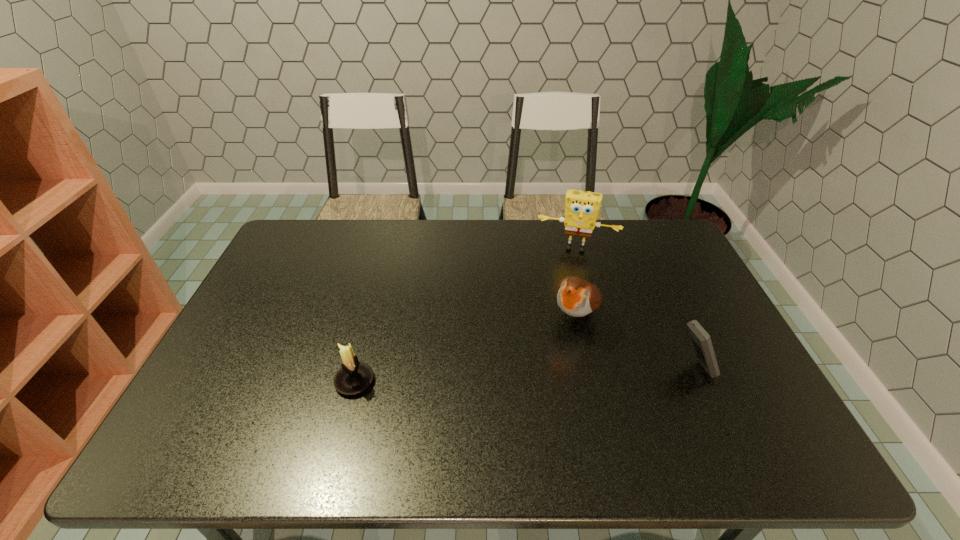
Select which object is the closest to the calculator. Please provide its 2D coordinates. Your answer should be formatted as a tuple, i.e. [(x, y)], where the tuple contains the x and y coordinates of a point satisfying the conditions above.

[(576, 297)]

Where is `free space that satisfies the following two spatial constraints: 1. on the back side of the candle holder; 2. on the right side of the sponge`? This screenshot has height=540, width=960. free space that satisfies the following two spatial constraints: 1. on the back side of the candle holder; 2. on the right side of the sponge is located at coordinates pyautogui.click(x=389, y=248).

Identify the location of free spot that satisfies the following two spatial constraints: 1. on the front side of the sponge; 2. on the front-facing side of the calculator. (609, 368).

Identify the location of free location that satisfies the following two spatial constraints: 1. on the back side of the candle holder; 2. on the left side of the second farthest object. Image resolution: width=960 pixels, height=540 pixels. (372, 316).

Locate an element on the screen. free space that satisfies the following two spatial constraints: 1. on the front side of the farthest object; 2. on the front-facing side of the rightmost object is located at coordinates (609, 368).

The height and width of the screenshot is (540, 960). I want to click on free spot that satisfies the following two spatial constraints: 1. on the back side of the candle holder; 2. on the front-facing side of the calculator, so click(x=358, y=368).

Where is `vacant space that satisfies the following two spatial constraints: 1. on the front side of the calculator; 2. on the front-facing side of the bird`? Image resolution: width=960 pixels, height=540 pixels. vacant space that satisfies the following two spatial constraints: 1. on the front side of the calculator; 2. on the front-facing side of the bird is located at coordinates (588, 368).

The image size is (960, 540). What are the coordinates of `vacant space that satisfies the following two spatial constraints: 1. on the front side of the bird; 2. on the front-facing side of the rightmost object` in the screenshot? It's located at [x=588, y=368].

Locate an element on the screen. The image size is (960, 540). blank area in the image that satisfies the following two spatial constraints: 1. on the back side of the sponge; 2. on the left side of the bird is located at coordinates (561, 248).